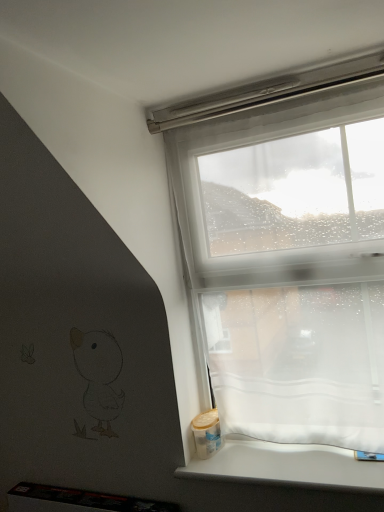
What is the approximate height of transparent fabric at upper right?

The height of transparent fabric at upper right is 1.09 meters.

At what (x,y) coordinates should I click in order to perform the action: click on transparent fabric at upper right. Please return your answer as a coordinate pair (x, y). Image resolution: width=384 pixels, height=512 pixels. Looking at the image, I should click on (277, 255).

The height and width of the screenshot is (512, 384). What do you see at coordinates (277, 255) in the screenshot?
I see `transparent fabric at upper right` at bounding box center [277, 255].

Find the location of `white matte window sill at lower right`. white matte window sill at lower right is located at coordinates (288, 466).

What do you see at coordinates (288, 466) in the screenshot?
I see `white matte window sill at lower right` at bounding box center [288, 466].

Measure the distance between point (289, 465) and camera.

A distance of 1.26 meters exists between point (289, 465) and camera.

Image resolution: width=384 pixels, height=512 pixels. In order to click on transparent fabric at upper right in this screenshot , I will do `click(277, 255)`.

Considering the relative positions of white matte window sill at lower right and transparent fabric at upper right in the image provided, is white matte window sill at lower right to the left or to the right of transparent fabric at upper right?

white matte window sill at lower right is to the left of transparent fabric at upper right.

Who is more distant, white matte window sill at lower right or transparent fabric at upper right?

transparent fabric at upper right.

Which is closer, (353,474) or (351,306)?

The point (353,474) is in front.

From the image's perspective, is white matte window sill at lower right located above or below transparent fabric at upper right?

Based on their image positions, white matte window sill at lower right is located beneath transparent fabric at upper right.

From a real-world perspective, is white matte window sill at lower right physically located above or below transparent fabric at upper right?

white matte window sill at lower right is below transparent fabric at upper right.

Considering the sizes of white matte window sill at lower right and transparent fabric at upper right in the image, is white matte window sill at lower right wider or thinner than transparent fabric at upper right?

Clearly, white matte window sill at lower right has more width compared to transparent fabric at upper right.

Between white matte window sill at lower right and transparent fabric at upper right, which one has more height?

transparent fabric at upper right is taller.

Is white matte window sill at lower right bigger or smaller than transparent fabric at upper right?

In the image, white matte window sill at lower right appears to be smaller than transparent fabric at upper right.

Does white matte window sill at lower right contain transparent fabric at upper right?

Definitely not — transparent fabric at upper right is not inside white matte window sill at lower right.

Is white matte window sill at lower right placed right next to transparent fabric at upper right?

No, white matte window sill at lower right is not next to transparent fabric at upper right.

Is white matte window sill at lower right facing away from transparent fabric at upper right?

That's not correct — white matte window sill at lower right is not looking away from transparent fabric at upper right.

Identify the location of window sill located underneath the transparent fabric at upper right (from a real-world perspective). (288, 466).

In the image, is transparent fabric at upper right on the left side or the right side of white matte window sill at lower right?

transparent fabric at upper right is to the right of white matte window sill at lower right.

Which object is closer to the camera, transparent fabric at upper right or white matte window sill at lower right?

white matte window sill at lower right is in front.

Which is further, (296, 254) or (214, 461)?

Positioned behind is point (214, 461).

From the image's perspective, who appears lower, transparent fabric at upper right or white matte window sill at lower right?

From the image's view, white matte window sill at lower right is below.

From a real-world perspective, is transparent fabric at upper right positioned over white matte window sill at lower right based on gravity?

Yes, from a real-world perspective, transparent fabric at upper right is on top of white matte window sill at lower right.

Considering the sizes of objects transparent fabric at upper right and white matte window sill at lower right in the image provided, who is wider, transparent fabric at upper right or white matte window sill at lower right?

white matte window sill at lower right is wider.

In terms of height, does transparent fabric at upper right look taller or shorter compared to white matte window sill at lower right?

In the image, transparent fabric at upper right appears to be taller than white matte window sill at lower right.

Looking at the image, does transparent fabric at upper right seem bigger or smaller compared to white matte window sill at lower right?

transparent fabric at upper right is bigger than white matte window sill at lower right.

Choose the correct answer: Is transparent fabric at upper right inside white matte window sill at lower right or outside it?

transparent fabric at upper right is located beyond the bounds of white matte window sill at lower right.

Is transparent fabric at upper right next to white matte window sill at lower right and touching it?

No.

Consider the image. Is transparent fabric at upper right looking in the opposite direction of white matte window sill at lower right?

No, transparent fabric at upper right is not facing the opposite direction of white matte window sill at lower right.

Locate an element on the screen. window sill located underneath the transparent fabric at upper right (from a real-world perspective) is located at coordinates (288, 466).

This screenshot has height=512, width=384. In order to click on window to the right of white matte window sill at lower right in this screenshot , I will do `click(277, 255)`.

Find the location of a particular element. window above the white matte window sill at lower right (from a real-world perspective) is located at coordinates (277, 255).